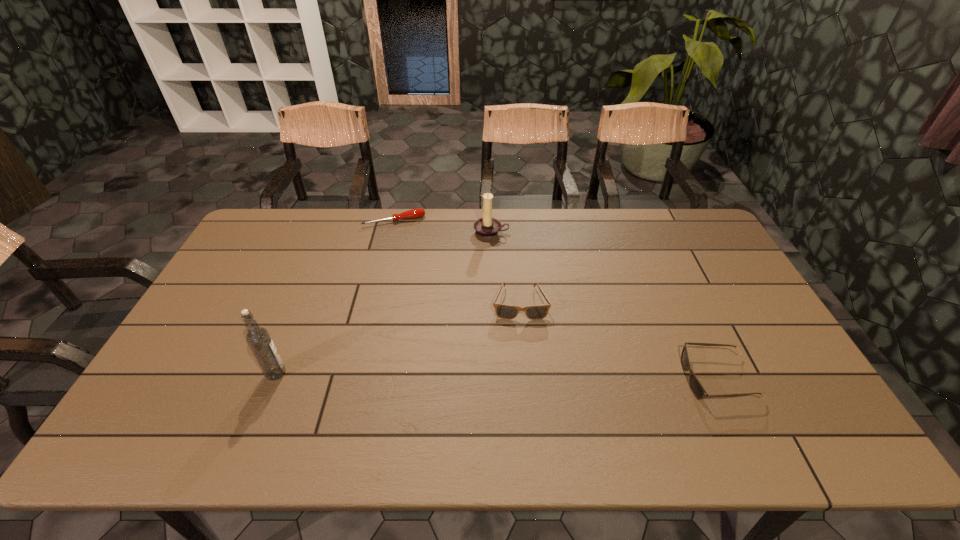
Locate an element on the screen. Image resolution: width=960 pixels, height=540 pixels. vacant space that's between the leftmost object and the third nearest object is located at coordinates (398, 338).

Identify the location of vacant area that lies between the farther sunglasses and the fourth shortest object. The width and height of the screenshot is (960, 540). (506, 268).

At what (x,y) coordinates should I click in order to perform the action: click on blank region between the nearer sunglasses and the vodka. Please return your answer as a coordinate pair (x, y). Looking at the image, I should click on (496, 376).

Point out which object is positioned as the nearest to the candle holder. Please provide its 2D coordinates. Your answer should be formatted as a tuple, i.e. [(x, y)], where the tuple contains the x and y coordinates of a point satisfying the conditions above.

[(414, 213)]

Identify which object is the third closest to the shorter sunglasses. Please provide its 2D coordinates. Your answer should be formatted as a tuple, i.e. [(x, y)], where the tuple contains the x and y coordinates of a point satisfying the conditions above.

[(414, 213)]

I want to click on blank area in the image that satisfies the following two spatial constraints: 1. on the front side of the shorter sunglasses; 2. on the lenses of the farther sunglasses, so click(527, 379).

At what (x,y) coordinates should I click in order to perform the action: click on free space in the image that satisfies the following two spatial constraints: 1. on the front side of the shorter sunglasses; 2. on the lenses of the shortest object. Please return your answer as a coordinate pair (x, y). Looking at the image, I should click on (356, 379).